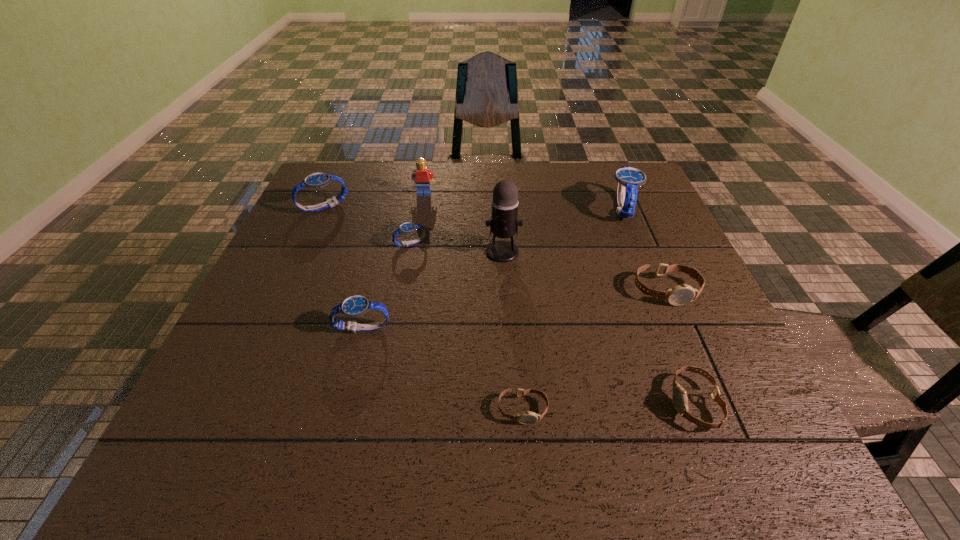
You are a GUI agent. You are given a task and a screenshot of the screen. Output one action in this format:
    pyautogui.click(x=<x>, y=<y>)
    Task: Click on the free space that is in between the tallest watch and the farthest beige watch
    This screenshot has width=960, height=540.
    Given the screenshot: What is the action you would take?
    pyautogui.click(x=643, y=249)

Find the location of a particular element. Image resolution: width=960 pixels, height=540 pixels. free point between the fourth nearest watch and the Lego is located at coordinates (545, 242).

In order to click on free space between the fourth nearest watch and the second nearest blue watch in this screenshot , I will do `click(538, 267)`.

Locate an element on the screen. free space that is in between the smallest blue watch and the shortest watch is located at coordinates (467, 327).

At what (x,y) coordinates should I click in order to perform the action: click on vacant area that lies between the fourth tallest object and the tallest watch. Please return your answer as a coordinate pair (x, y). Looking at the image, I should click on (472, 208).

The width and height of the screenshot is (960, 540). What are the coordinates of `vacant point located between the third biggest blue watch and the farthest beige watch` in the screenshot? It's located at (515, 309).

Locate an element on the screen. This screenshot has height=540, width=960. vacant area that lies between the second biggest blue watch and the rightmost blue watch is located at coordinates (472, 208).

Locate an element on the screen. This screenshot has height=540, width=960. free spot between the second biggest beige watch and the tallest object is located at coordinates (598, 327).

Where is `empty space that is in between the leftmost beige watch and the fifth farthest watch`? Image resolution: width=960 pixels, height=540 pixels. empty space that is in between the leftmost beige watch and the fifth farthest watch is located at coordinates [x=443, y=369].

Identify which object is the seventh closest to the tallest watch. Please provide its 2D coordinates. Your answer should be formatted as a tuple, i.e. [(x, y)], where the tuple contains the x and y coordinates of a point satisfying the conditions above.

[(354, 306)]